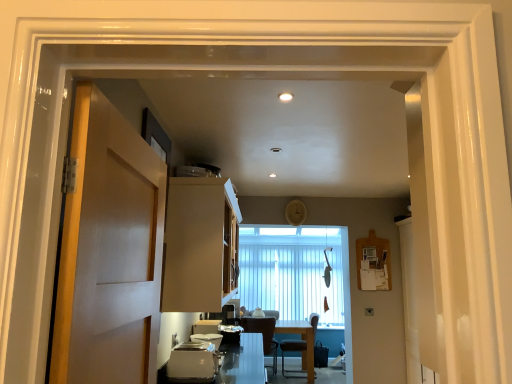
Question: Based on their sizes in the image, would you say matte white door at left is bigger or smaller than satin silver toaster at lower center?

Choices:
 (A) big
 (B) small

Answer: (A)

Question: From a real-world perspective, relative to satin silver toaster at lower center, is matte white door at left vertically above or below?

Choices:
 (A) below
 (B) above

Answer: (B)

Question: Which is farther from the white blinds at center?

Choices:
 (A) dark brown leather chair at center, which is the first chair from right to left
 (B) matte wood cabinet at center
 (C) satin silver toaster at lower center
 (D) white glossy countertop at lower center
 (E) matte white door at left

Answer: (E)

Question: Which object is the farthest from the matte wood cabinet at center?

Choices:
 (A) matte white door at left
 (B) satin silver toaster at lower center
 (C) white blinds at center
 (D) white glossy countertop at lower center
 (E) dark brown leather chair at center, acting as the second chair starting from the left

Answer: (E)